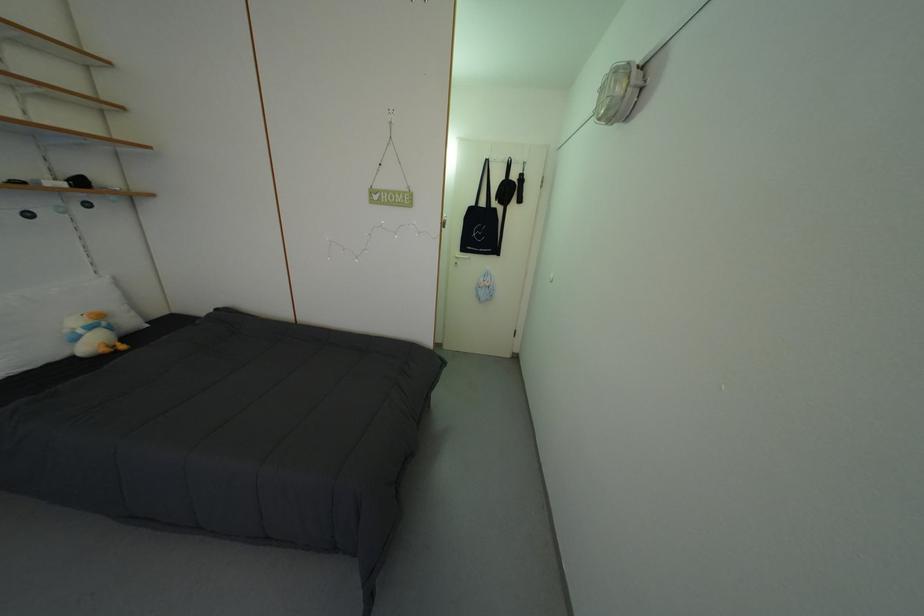
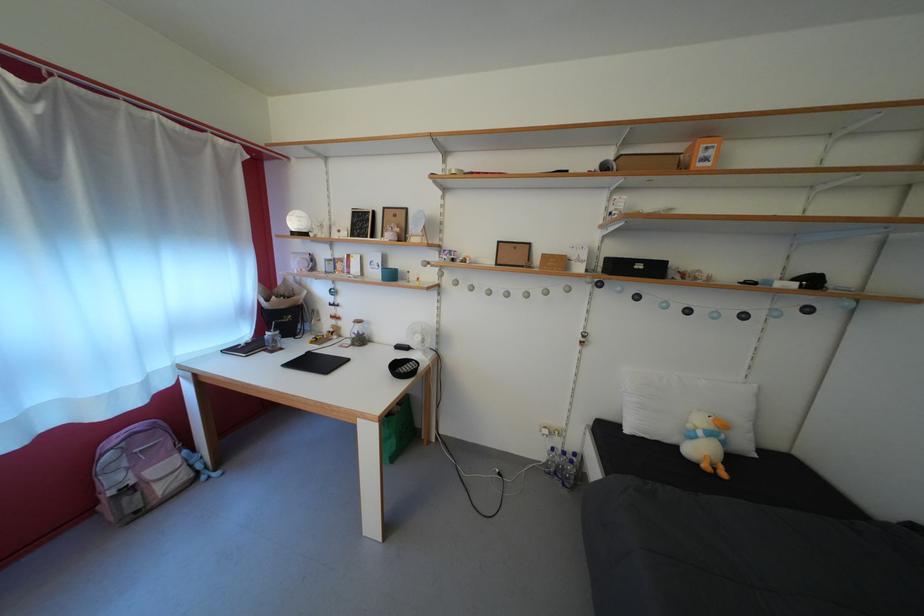
In the second image, find the point that corresponds to point (90, 338) in the first image.

(709, 439)